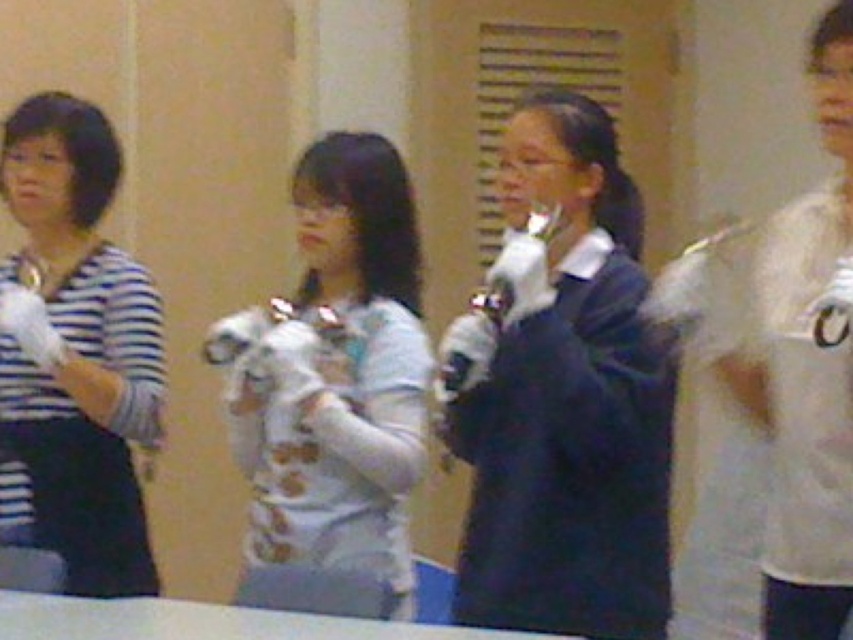
Question: Can you confirm if dark blue sweater at center is smaller than striped fabric shirt at left?

Choices:
 (A) no
 (B) yes

Answer: (A)

Question: Which of the following is the closest to the observer?

Choices:
 (A) (134, 269)
 (B) (325, 419)
 (C) (509, 234)

Answer: (B)

Question: Which point is closer to the camera?

Choices:
 (A) striped fabric shirt at left
 (B) white matte shirt at center
 (C) dark blue sweater at center

Answer: (C)

Question: Considering the real-world distances, which object is farthest from the white matte shirt at center?

Choices:
 (A) dark blue sweater at center
 (B) striped fabric shirt at left

Answer: (B)

Question: Can you confirm if dark blue sweater at center is thinner than striped fabric shirt at left?

Choices:
 (A) yes
 (B) no

Answer: (B)

Question: Observing the image, what is the correct spatial positioning of dark blue sweater at center in reference to striped fabric shirt at left?

Choices:
 (A) above
 (B) below

Answer: (B)